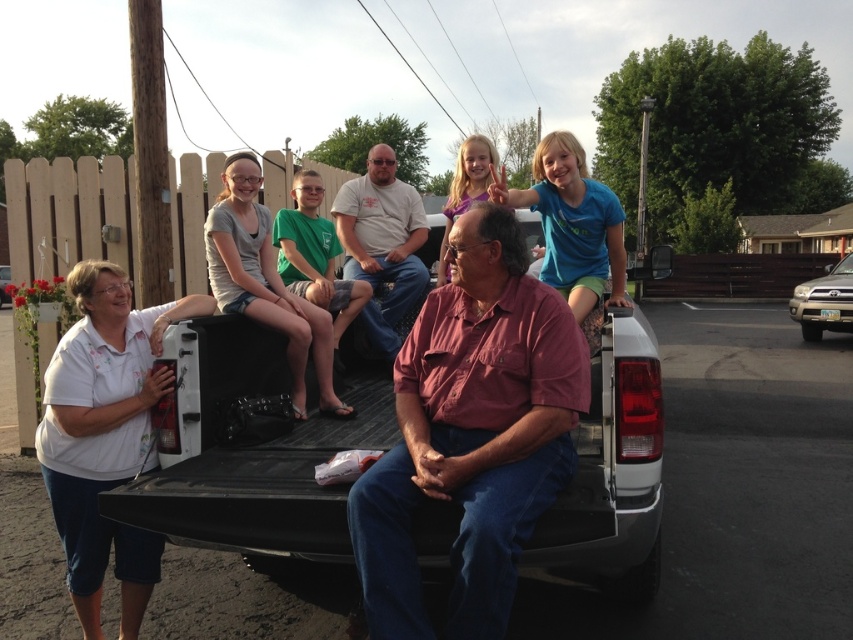
Question: Is matte pink shirt at center below white matte shirt at lower left?

Choices:
 (A) yes
 (B) no

Answer: (B)

Question: Which object is farther from the camera taking this photo?

Choices:
 (A) white matte shirt at lower left
 (B) matte pink shirt at center

Answer: (A)

Question: Can you confirm if matte pink shirt at center is positioned below white matte shirt at lower left?

Choices:
 (A) no
 (B) yes

Answer: (A)

Question: Which point appears closest to the camera in this image?

Choices:
 (A) (515, 467)
 (B) (86, 339)

Answer: (A)

Question: Is matte pink shirt at center further to camera compared to white matte shirt at lower left?

Choices:
 (A) no
 (B) yes

Answer: (A)